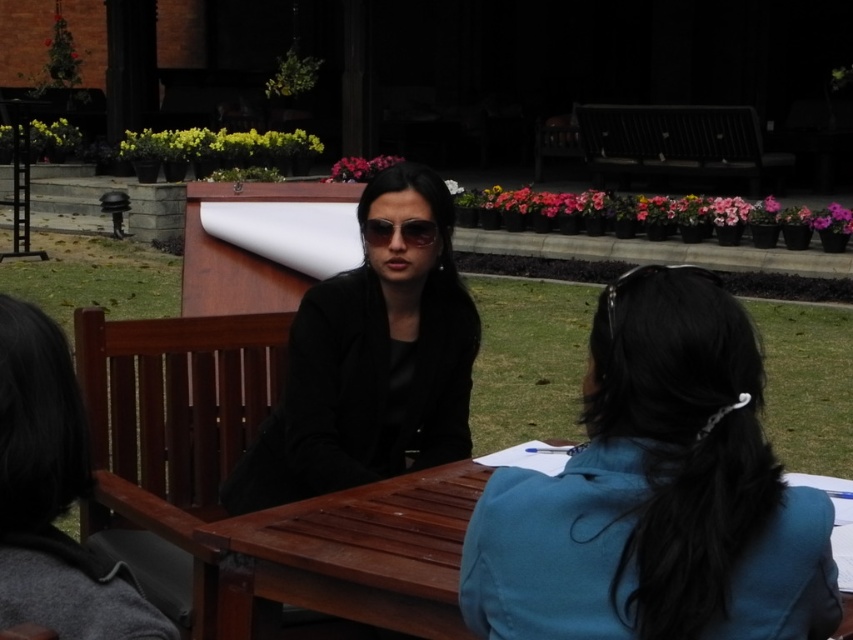
Question: Can you confirm if black matte jacket at center is positioned to the right of dark wood park bench at upper center?

Choices:
 (A) yes
 (B) no

Answer: (B)

Question: Among these objects, which one is farthest from the camera?

Choices:
 (A) black matte jacket at center
 (B) wooden table at center

Answer: (A)

Question: Does black matte jacket at center appear under wooden table at center?

Choices:
 (A) no
 (B) yes

Answer: (A)

Question: Estimate the real-world distances between objects in this image. Which object is farther from the wooden table at center?

Choices:
 (A) black matte jacket at center
 (B) clear plastic goggles at center
 (C) dark wood park bench at upper center

Answer: (C)

Question: Which point appears farthest from the camera in this image?

Choices:
 (A) [685, 124]
 (B) [677, 632]
 (C) [757, 570]

Answer: (A)

Question: Can you confirm if blue fabric at center is thinner than black matte jacket at center?

Choices:
 (A) yes
 (B) no

Answer: (A)